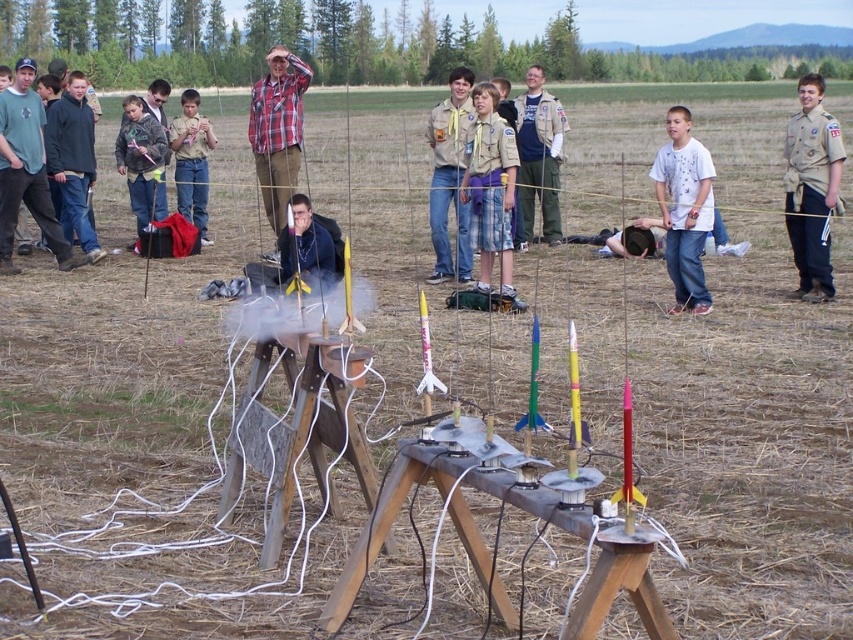
Which is below, white cotton shirt at center or plaid flannel shirt at center?

white cotton shirt at center

At what (x,y) coordinates should I click in order to perform the action: click on white cotton shirt at center. Please return your answer as a coordinate pair (x, y). Looking at the image, I should click on click(683, 209).

I want to click on white cotton shirt at center, so pyautogui.click(x=683, y=209).

Does dark blue fleece jacket at left have a smaller size compared to khaki pants at center?

Yes.

Can you confirm if dark blue fleece jacket at left is wider than khaki pants at center?

Yes, dark blue fleece jacket at left is wider than khaki pants at center.

Does point (51, 138) come in front of point (537, 72)?

Yes, it is in front of point (537, 72).

Where is `dark blue fleece jacket at left`? dark blue fleece jacket at left is located at coordinates (73, 161).

What do you see at coordinates (277, 131) in the screenshot?
I see `plaid flannel shirt at center` at bounding box center [277, 131].

Which of these two, plaid flannel shirt at center or brown uniform at center, stands shorter?

plaid flannel shirt at center

Between point (264, 172) and point (436, 220), which one is positioned in front?

Point (436, 220)

Where is `plaid flannel shirt at center`? plaid flannel shirt at center is located at coordinates (277, 131).